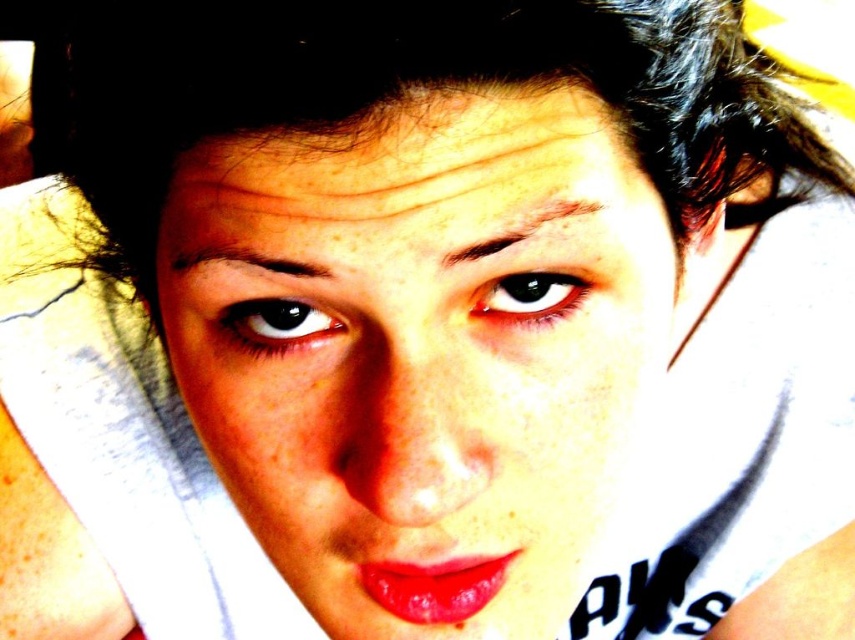
You are a photographer adjusting the lighting for a portrait. You notice the dark brown hair at upper center and the dark brown eye at center. Which object is positioned to the right side of the other?

The dark brown hair at upper center is to the right of the dark brown eye at center.

Looking at this image, you are a makeup artist preparing to apply eyeliner to the black glossy eye at upper left. You need to ensure there is enough space between the dark brown hair at upper center and the eye to avoid smudging the eyeliner. Is there enough vertical space between them?

The dark brown hair at upper center is taller than the black glossy eye at upper left, so there is sufficient vertical space to apply eyeliner without smudging.

Based on the scene description, which object is positioned higher on the face between the dark brown hair at upper center and the black glossy eye at upper left?

The dark brown hair at upper center is positioned higher on the face as it is located above the black glossy eye at upper left.